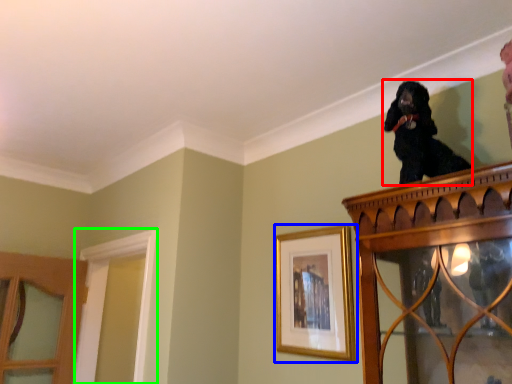
Question: Which object is the closest to the dog (highlighted by a red box)? Choose among these: picture frame (highlighted by a blue box) or window frame (highlighted by a green box).

Choices:
 (A) picture frame
 (B) window frame

Answer: (A)